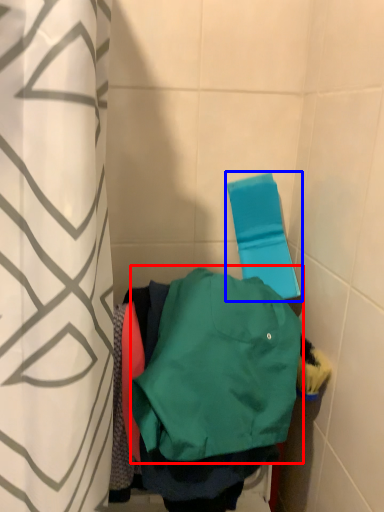
Question: Which of the following is the closest to the observer, sweatshirt (highlighted by a red box) or beach towel (highlighted by a blue box)?

Choices:
 (A) sweatshirt
 (B) beach towel

Answer: (A)